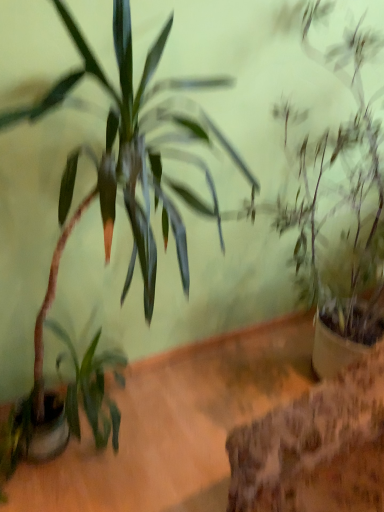
Where is `vacant region below green glossy plant at center (from a real-world perspective)`? The image size is (384, 512). vacant region below green glossy plant at center (from a real-world perspective) is located at coordinates (117, 449).